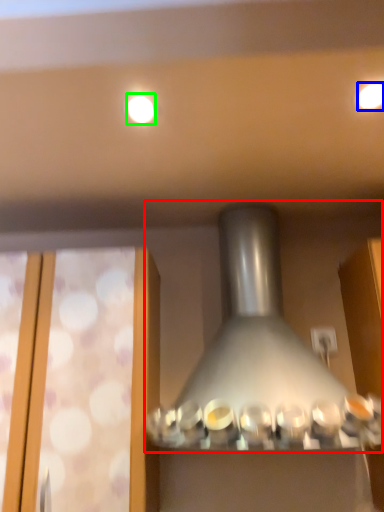
Question: Considering the real-world distances, which object is farthest from lamp (highlighted by a red box)? lighting (highlighted by a blue box) or lighting (highlighted by a green box)?

Choices:
 (A) lighting
 (B) lighting

Answer: (A)